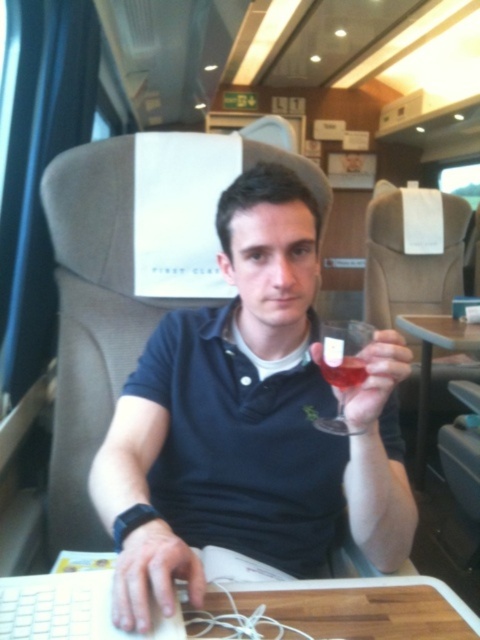
You are a passenger in the train carriage and want to place your phone on the wooden table at lower center. Considering the distance, can you reach it from your current position?

The wooden table at lower center is 23.87 inches away from camera, so yes, you can reach it from your current position as the distance is within typical arm reach.

You are a fashion designer observing the person in the train carriage. You need to determine if the matte black polo shirt at center can be folded to fit into the translucent glass at center. Based on their sizes, what do you conclude?

The matte black polo shirt at center is wider than the translucent glass at center, so it cannot be folded to fit inside the glass.

You are a photographer taking a picture of the matte black polo shirt at center and the translucent glass at center. To ensure both are in focus, you need to know their positions. Which object is located to the left of the other?

The matte black polo shirt at center is positioned on the left side of the translucent glass at center.